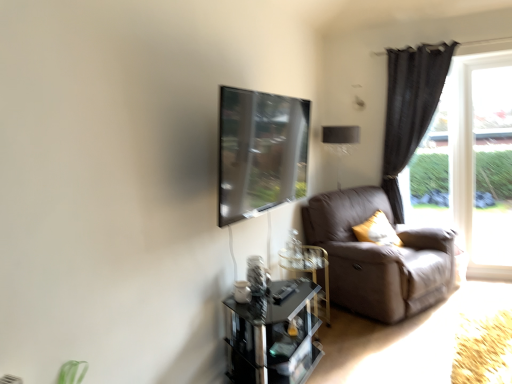
Identify the location of vacant space to the right of clear glass table at lower center. (352, 325).